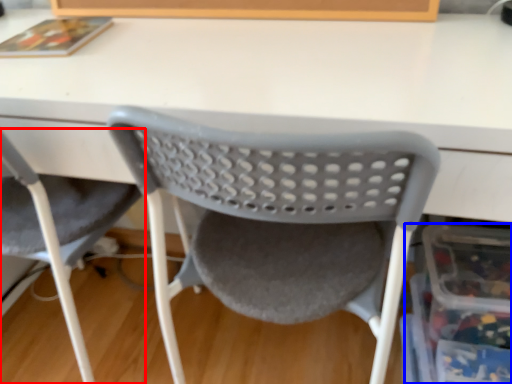
Question: Which object is closer to the camera taking this photo, chair (highlighted by a red box) or storage box (highlighted by a blue box)?

Choices:
 (A) chair
 (B) storage box

Answer: (A)